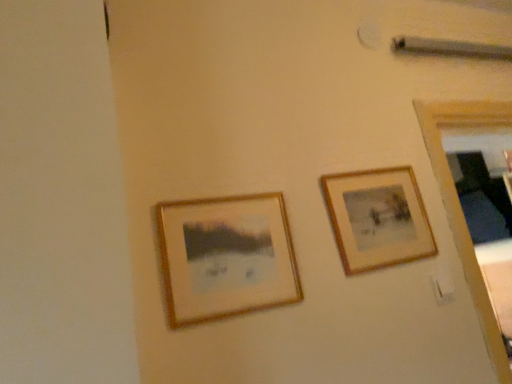
Question: Should I look upward or downward to see wooden framed picture at center left, the first picture frame in the front-to-back sequence?

Choices:
 (A) down
 (B) up

Answer: (A)

Question: Is wooden frame at upper right, which is counted as the first picture frame, starting from the right, closer to the viewer compared to wooden framed picture at center left, the first picture frame in the front-to-back sequence?

Choices:
 (A) yes
 (B) no

Answer: (B)

Question: Is wooden frame at upper right, which is counted as the first picture frame, starting from the right, positioned beyond the bounds of wooden framed picture at center left, arranged as the first picture frame when viewed from the left?

Choices:
 (A) yes
 (B) no

Answer: (A)

Question: Is wooden frame at upper right, which appears as the second picture frame when viewed from the front, at the right side of wooden framed picture at center left, which is the second picture frame from back to front?

Choices:
 (A) yes
 (B) no

Answer: (A)

Question: From a real-world perspective, is wooden frame at upper right, placed as the second picture frame when sorted from left to right, beneath wooden framed picture at center left, the first picture frame in the front-to-back sequence?

Choices:
 (A) yes
 (B) no

Answer: (B)

Question: From the image's perspective, is wooden frame at upper right, which is counted as the first picture frame, starting from the right, above wooden framed picture at center left, which is the second picture frame from back to front?

Choices:
 (A) yes
 (B) no

Answer: (A)

Question: Can you confirm if wooden frame at upper right, which appears as the second picture frame when viewed from the front, is positioned to the left of wooden framed picture at center left, which is the second picture frame from back to front?

Choices:
 (A) no
 (B) yes

Answer: (A)

Question: Considering the relative positions of wooden framed picture at center left, which ranks as the 2th picture frame in right-to-left order, and wooden frame at upper right, which is counted as the first picture frame, starting from the right, in the image provided, is wooden framed picture at center left, which ranks as the 2th picture frame in right-to-left order, in front of wooden frame at upper right, which is counted as the first picture frame, starting from the right,?

Choices:
 (A) yes
 (B) no

Answer: (A)

Question: Can you confirm if wooden framed picture at center left, the first picture frame in the front-to-back sequence, is wider than wooden frame at upper right, which is counted as the first picture frame, starting from the right?

Choices:
 (A) no
 (B) yes

Answer: (B)

Question: From the image's perspective, is wooden framed picture at center left, which ranks as the 2th picture frame in right-to-left order, below wooden frame at upper right, placed as the second picture frame when sorted from left to right?

Choices:
 (A) yes
 (B) no

Answer: (A)

Question: Does wooden framed picture at center left, which is the second picture frame from back to front, have a larger size compared to wooden frame at upper right, which is counted as the first picture frame, starting from the right?

Choices:
 (A) no
 (B) yes

Answer: (A)

Question: From a real-world perspective, is wooden framed picture at center left, the first picture frame in the front-to-back sequence, positioned under wooden frame at upper right, which is counted as the first picture frame, starting from the right, based on gravity?

Choices:
 (A) yes
 (B) no

Answer: (A)

Question: Is wooden framed picture at center left, arranged as the first picture frame when viewed from the left, shorter than wooden frame at upper right, which is counted as the first picture frame, starting from the right?

Choices:
 (A) no
 (B) yes

Answer: (B)

Question: Does point tap(211, 317) appear closer or farther from the camera than point tap(356, 269)?

Choices:
 (A) farther
 (B) closer

Answer: (B)